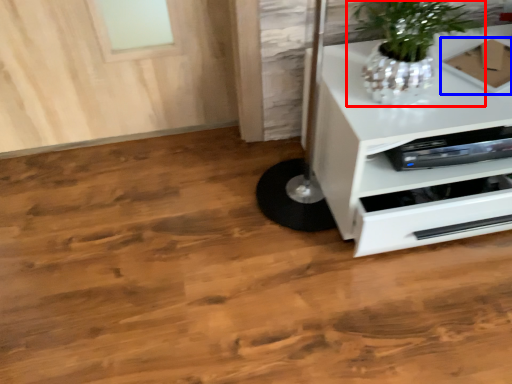
Question: Which object appears closest to the camera in this image, houseplant (highlighted by a red box) or cardboard box (highlighted by a blue box)?

Choices:
 (A) houseplant
 (B) cardboard box

Answer: (A)